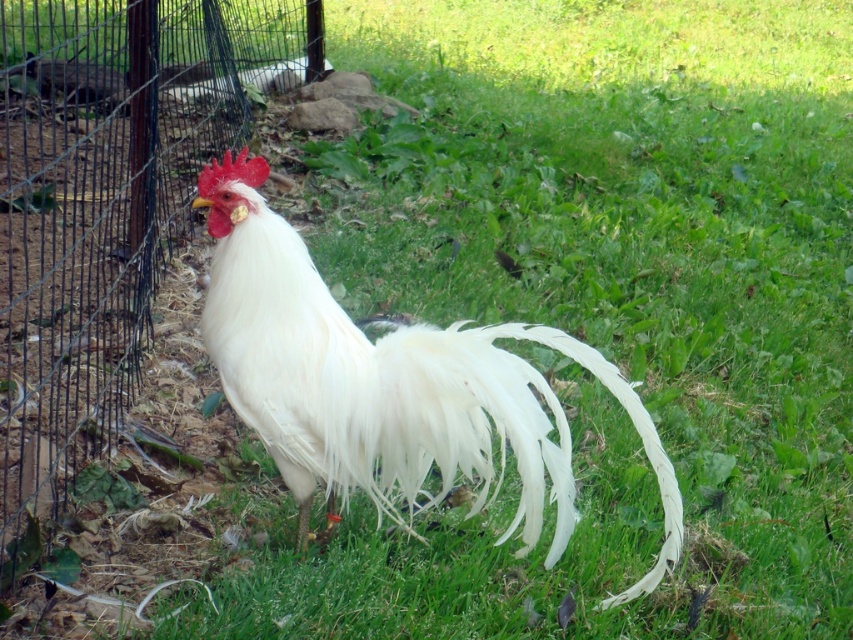
Does wire mesh fence at left have a lesser width compared to white feathered rooster at center?

No, wire mesh fence at left is not thinner than white feathered rooster at center.

In the scene shown: Who is more distant from viewer, (x=103, y=300) or (x=405, y=435)?

The point (x=103, y=300) is behind.

Is point (22, 152) positioned after point (393, 499)?

Yes, point (22, 152) is behind point (393, 499).

Locate an element on the screen. The width and height of the screenshot is (853, 640). wire mesh fence at left is located at coordinates (x=106, y=208).